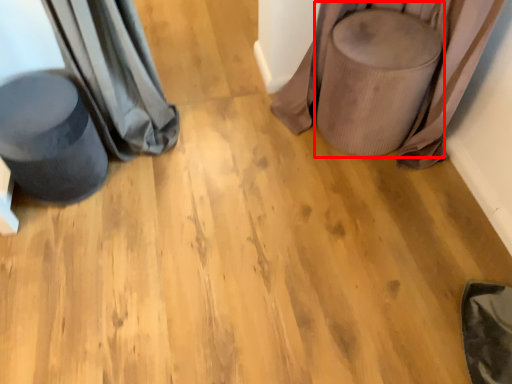
Question: Where is swivel chair (annotated by the red box) located in relation to swivel chair in the image?

Choices:
 (A) left
 (B) right

Answer: (B)